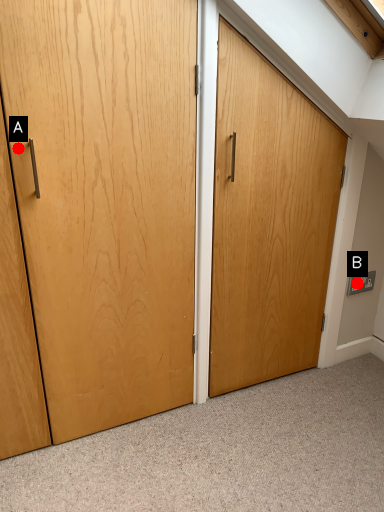
Question: Two points are circled on the image, labeled by A and B beside each circle. Which point is further to the camera?

Choices:
 (A) A is further
 (B) B is further

Answer: (B)